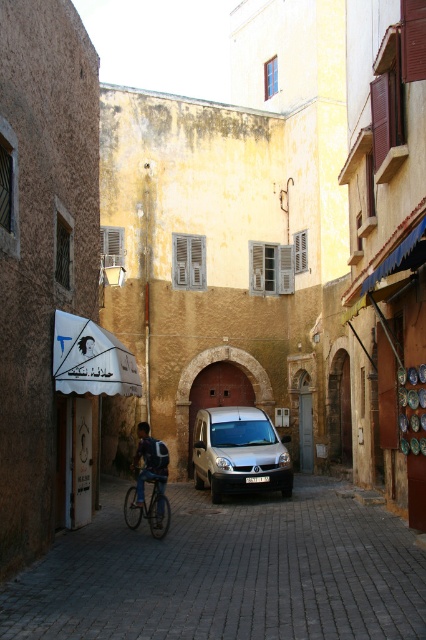
Looking at this image, you are a delivery person trying to navigate through the gray cobblestone alley at center with your shiny metallic bicycle at center. Based on the scene, can you pass through the alley without bending down?

The gray cobblestone alley at center is not as tall as shiny metallic bicycle at center, which means the alley is shorter in height compared to the bicycle. Therefore, you would need to bend down or lower the bicycle to pass through the alley without hitting the top.

From the picture: You are standing in the middle of the alleyway and want to take a photo of the white fabric canopy at left. Which direction should you face to capture it in your camera?

You should face to the left to capture the white fabric canopy at left since it is located at the left side of the alleyway.